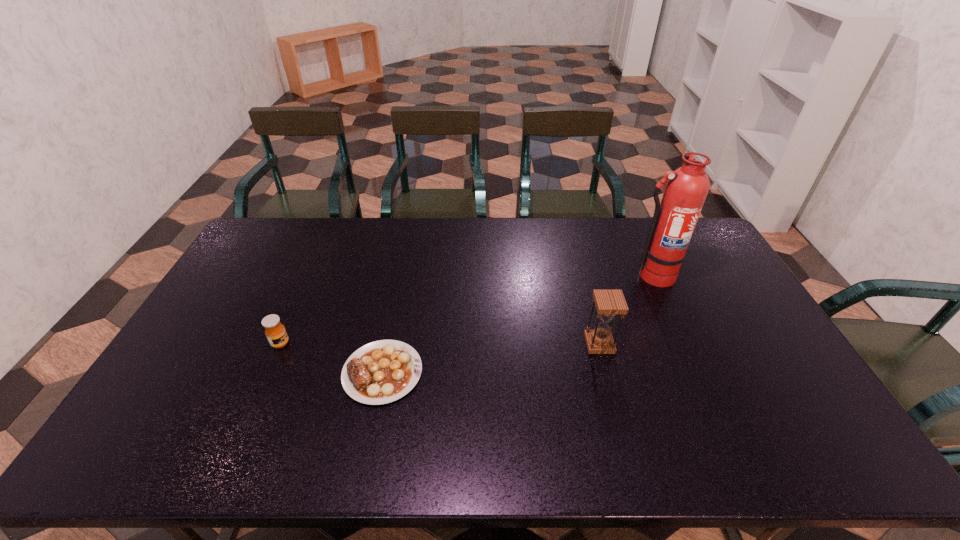
In order to click on the tallest object in this screenshot , I will do `click(674, 220)`.

Where is `the farthest object`? The image size is (960, 540). the farthest object is located at coordinates (674, 220).

Find the location of a particular element. hourglass is located at coordinates (608, 303).

This screenshot has height=540, width=960. I want to click on the third object from left to right, so click(x=608, y=303).

Identify the location of the leftmost object. (275, 331).

This screenshot has width=960, height=540. Find the location of `honey`. honey is located at coordinates (x=275, y=331).

You are a GUI agent. You are given a task and a screenshot of the screen. Output one action in this format:
    pyautogui.click(x=<x>, y=<y>)
    Task: Click on the second object from left to right
    
    Given the screenshot: What is the action you would take?
    pyautogui.click(x=380, y=372)

At what (x,y) coordinates should I click in order to perform the action: click on the shortest object. Please return your answer as a coordinate pair (x, y). Looking at the image, I should click on (380, 372).

Identify the location of free region located on the label side of the farthest object. Image resolution: width=960 pixels, height=540 pixels. (698, 377).

Where is `free space located 0.240m on the back of the third shortest object`? free space located 0.240m on the back of the third shortest object is located at coordinates click(583, 280).